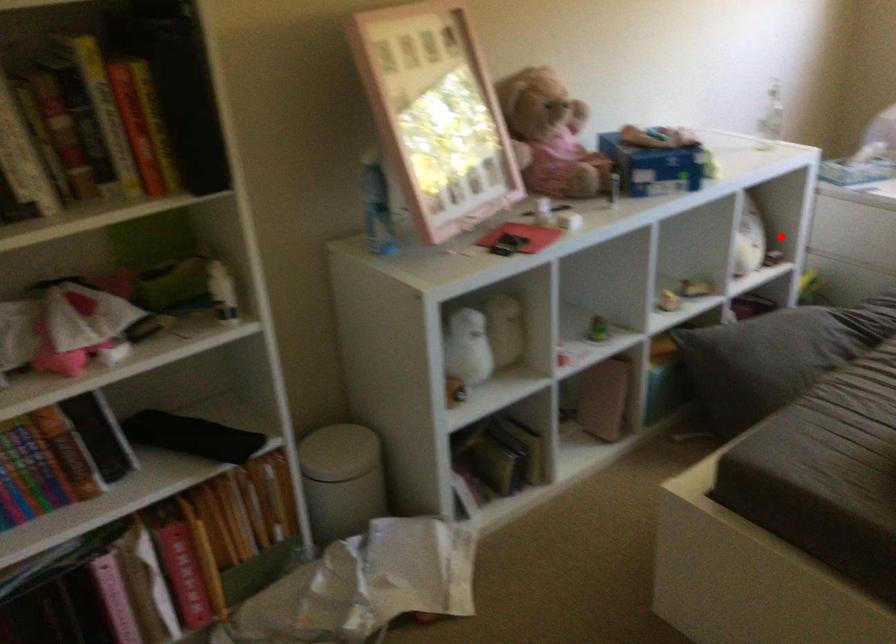
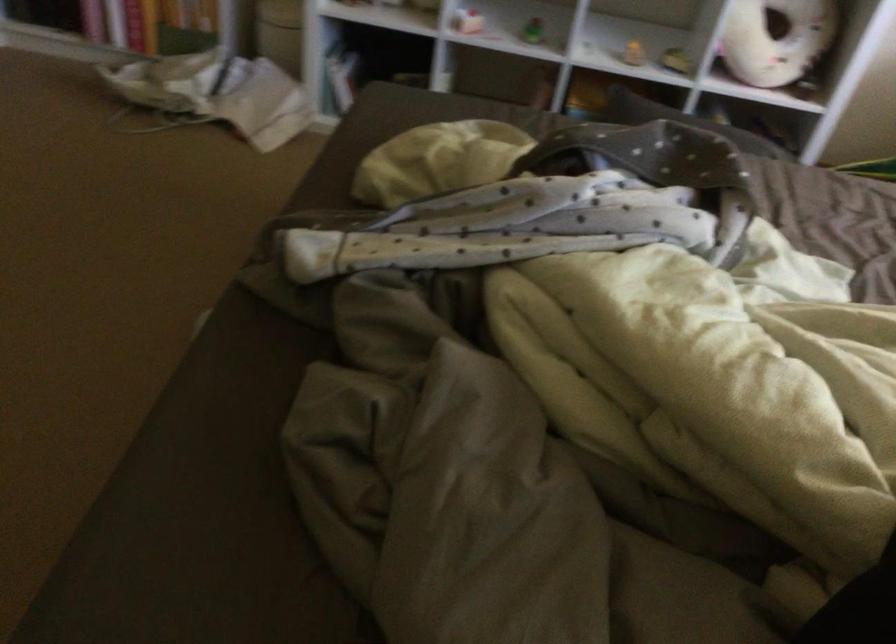
The point at the highlighted location is marked in the first image. Where is the corresponding point in the second image?

(777, 40)